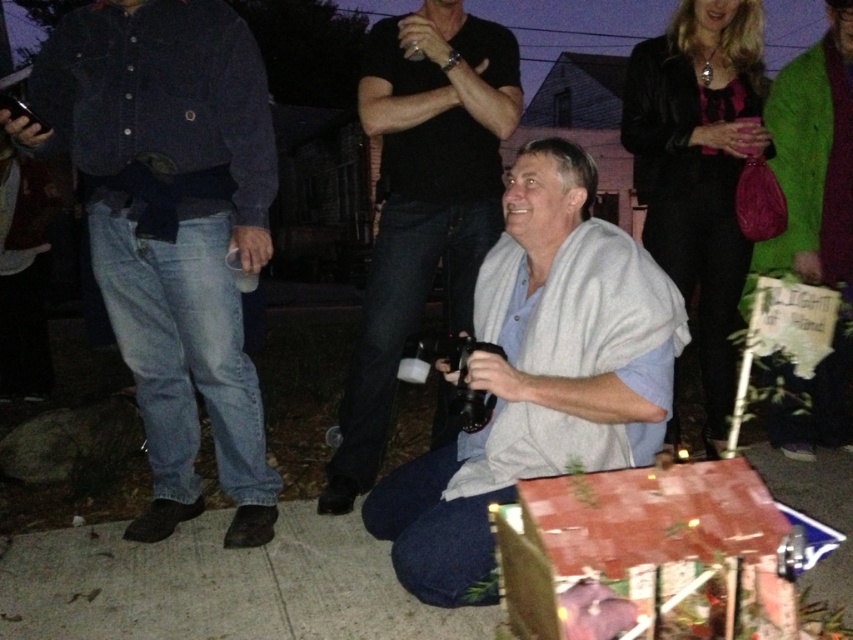
You are standing in the nighttime scene and want to hand a gift to the person wearing the velvet black robe at right and the green fuzzy robe at upper right. Which person should you approach first to give the gift without walking further away from your current position?

You should approach the velvet black robe at right first because it is closer to you than the green fuzzy robe at upper right, so you can give the gift without moving further away.

You are organizing a winter photoshoot and need to decide which item to place closer to the camera to emphasize its details. Given the gray woolen scarf at center and the green fuzzy robe at upper right, which item should you move closer to the camera to make it appear larger in the photo?

To make the item appear larger in the photo, you should move the gray woolen scarf at center closer to the camera since it is smaller in size compared to the green fuzzy robe at upper right.

You are organizing a photo shoot and need to place the gray woolen scarf at center and the velvet black robe at right in a way that maintains their visibility. Given their sizes, which object should be placed closer to the camera to ensure both are clearly visible in the photo?

The gray woolen scarf at center is smaller than the velvet black robe at right, so to ensure both are clearly visible, the gray woolen scarf at center should be placed closer to the camera.